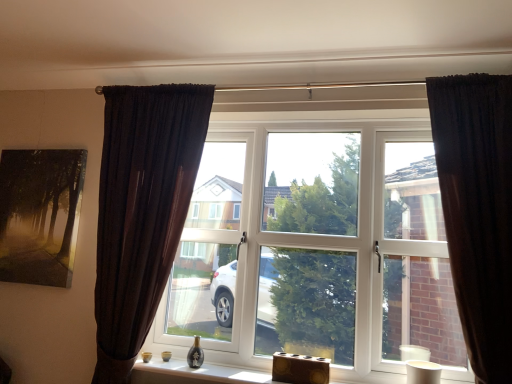
Question: From the image's perspective, does dark brown fabric curtain at left, the first curtain when ordered from left to right, appear lower than matte black painting at upper left?

Choices:
 (A) no
 (B) yes

Answer: (B)

Question: Can you confirm if dark brown fabric curtain at left, the first curtain when ordered from left to right, is positioned to the right of matte black painting at upper left?

Choices:
 (A) yes
 (B) no

Answer: (A)

Question: From a real-world perspective, is dark brown fabric curtain at left, marked as the 2th curtain in a right-to-left arrangement, positioned over matte black painting at upper left based on gravity?

Choices:
 (A) no
 (B) yes

Answer: (A)

Question: Can you confirm if dark brown fabric curtain at left, the first curtain when ordered from left to right, is bigger than matte black painting at upper left?

Choices:
 (A) yes
 (B) no

Answer: (A)

Question: Is dark brown fabric curtain at left, the first curtain when ordered from left to right, positioned with its back to matte black painting at upper left?

Choices:
 (A) yes
 (B) no

Answer: (B)

Question: From their relative heights in the image, would you say wooden block at lower center is taller or shorter than matte black painting at upper left?

Choices:
 (A) short
 (B) tall

Answer: (A)

Question: Is wooden block at lower center in front of or behind matte black painting at upper left in the image?

Choices:
 (A) front
 (B) behind

Answer: (A)

Question: Is wooden block at lower center inside the boundaries of matte black painting at upper left, or outside?

Choices:
 (A) inside
 (B) outside

Answer: (B)

Question: Does point (247, 370) appear closer or farther from the camera than point (26, 225)?

Choices:
 (A) farther
 (B) closer

Answer: (B)

Question: Would you say white plastic window at center is to the left or to the right of wooden block at lower center in the picture?

Choices:
 (A) left
 (B) right

Answer: (B)

Question: Does point (368, 316) appear closer or farther from the camera than point (314, 380)?

Choices:
 (A) farther
 (B) closer

Answer: (A)

Question: Is white plastic window at center in front of or behind wooden block at lower center in the image?

Choices:
 (A) front
 (B) behind

Answer: (A)

Question: Considering the positions of white plastic window at center and wooden block at lower center in the image, is white plastic window at center bigger or smaller than wooden block at lower center?

Choices:
 (A) small
 (B) big

Answer: (B)

Question: From a real-world perspective, relative to dark velvet curtain at right, which appears as the second curtain when viewed from the left, is matte black painting at upper left vertically above or below?

Choices:
 (A) above
 (B) below

Answer: (B)

Question: Considering their positions, is matte black painting at upper left located in front of or behind dark velvet curtain at right, which appears as the second curtain when viewed from the left?

Choices:
 (A) behind
 (B) front

Answer: (A)